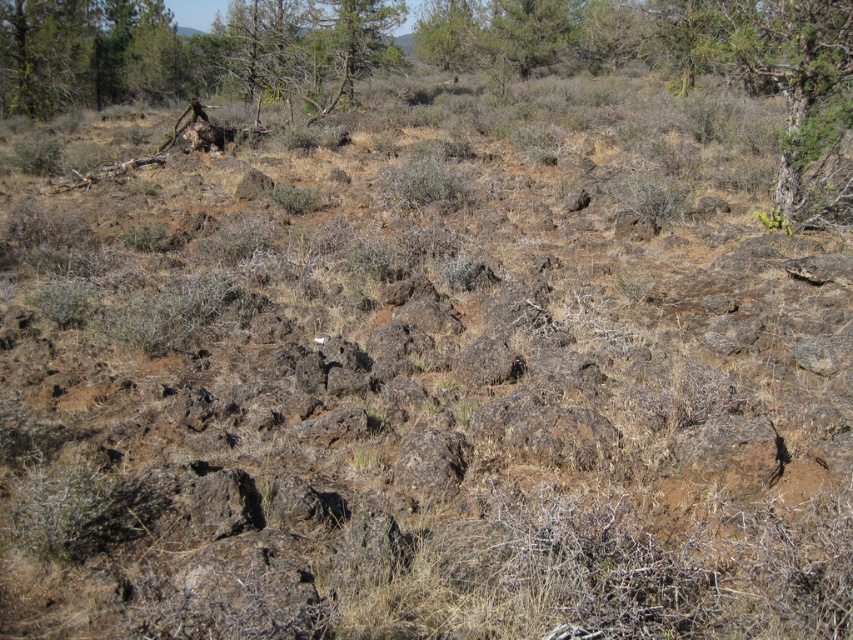
Is point (842, 209) positioned in front of point (370, 0)?

Yes, it is.

Where is `smooth bark tree at upper right`? This screenshot has height=640, width=853. smooth bark tree at upper right is located at coordinates (798, 96).

This screenshot has width=853, height=640. I want to click on brown bark tree at upper left, so click(86, 54).

Identify the location of brown bark tree at upper left. The height and width of the screenshot is (640, 853). (86, 54).

This screenshot has height=640, width=853. Find the location of `smooth bark tree at upper right`. smooth bark tree at upper right is located at coordinates (798, 96).

Can you confirm if smooth bark tree at upper right is shorter than brown bark tree at upper left?

Yes, smooth bark tree at upper right is shorter than brown bark tree at upper left.

In the scene shown: Who is more distant from viewer, (798, 92) or (86, 65)?

Positioned behind is point (86, 65).

At what (x,y) coordinates should I click in order to perform the action: click on smooth bark tree at upper right. Please return your answer as a coordinate pair (x, y). This screenshot has height=640, width=853. Looking at the image, I should click on (798, 96).